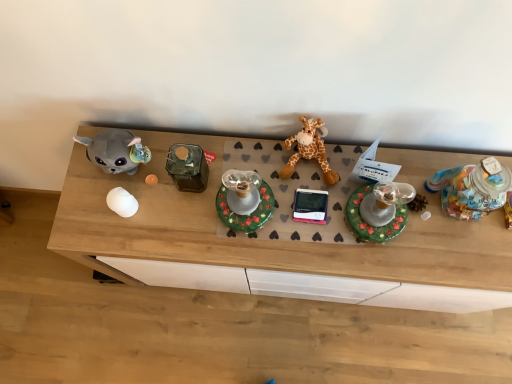
I want to click on empty space that is ontop of wooden desk at center (from a real-world perspective), so click(273, 208).